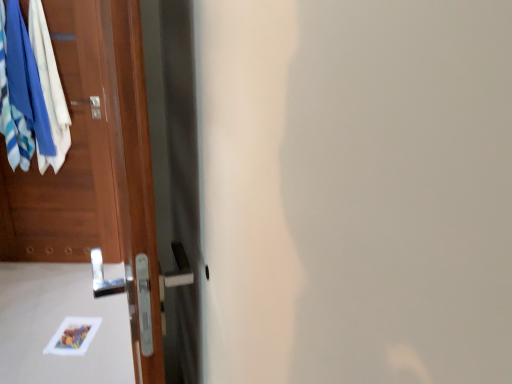
What is the approximate height of blue cotton socks at left?

blue cotton socks at left is 38.82 inches in height.

Image resolution: width=512 pixels, height=384 pixels. In order to click on blue cotton socks at left in this screenshot , I will do `click(31, 91)`.

Describe the element at coordinates (31, 91) in the screenshot. I see `blue cotton socks at left` at that location.

Describe the element at coordinates (94, 162) in the screenshot. I see `wooden door at left` at that location.

Image resolution: width=512 pixels, height=384 pixels. Identify the location of wooden door at left. [94, 162].

The image size is (512, 384). Identify the location of blue cotton socks at left. tap(31, 91).

Does blue cotton socks at left appear on the left side of wooden door at left?

Yes, blue cotton socks at left is to the left of wooden door at left.

Based on the photo, considering their positions, is blue cotton socks at left located in front of or behind wooden door at left?

blue cotton socks at left is positioned farther from the viewer than wooden door at left.

Is point (23, 133) closer to camera compared to point (49, 223)?

Yes, point (23, 133) is closer to viewer.

From the image's perspective, who appears lower, blue cotton socks at left or wooden door at left?

wooden door at left is shown below in the image.

From a real-world perspective, is blue cotton socks at left above or below wooden door at left?

blue cotton socks at left is situated higher than wooden door at left in the real world.

Does blue cotton socks at left have a greater width compared to wooden door at left?

Incorrect, the width of blue cotton socks at left does not surpass that of wooden door at left.

Based on the photo, does blue cotton socks at left have a lesser height compared to wooden door at left?

Yes, blue cotton socks at left is shorter than wooden door at left.

Who is smaller, blue cotton socks at left or wooden door at left?

blue cotton socks at left.

Would you say blue cotton socks at left contains wooden door at left?

No, wooden door at left is not surrounded by blue cotton socks at left.

Is blue cotton socks at left next to wooden door at left and touching it?

No, blue cotton socks at left is not next to wooden door at left.

Is blue cotton socks at left facing away from wooden door at left?

That's not correct — blue cotton socks at left is not looking away from wooden door at left.

This screenshot has width=512, height=384. What are the coordinates of `clothing lying above the wooden door at left (from the image's perspective)` in the screenshot? It's located at (31, 91).

Which object is positioned more to the left, wooden door at left or blue cotton socks at left?

Positioned to the left is blue cotton socks at left.

Who is more distant, wooden door at left or blue cotton socks at left?

blue cotton socks at left.

Between point (139, 378) and point (21, 62), which one is positioned in front?

The point (139, 378) is more forward.

From the image's perspective, would you say wooden door at left is positioned over blue cotton socks at left?

No, from the image's perspective, wooden door at left is not above blue cotton socks at left.

From a real-world perspective, is wooden door at left beneath blue cotton socks at left?

Correct, in the physical world, wooden door at left is lower than blue cotton socks at left.

Which object is wider, wooden door at left or blue cotton socks at left?

Wider between the two is wooden door at left.

In the scene shown: Which of these two, wooden door at left or blue cotton socks at left, stands shorter?

blue cotton socks at left.

Is wooden door at left smaller than blue cotton socks at left?

Incorrect, wooden door at left is not smaller in size than blue cotton socks at left.

Choose the correct answer: Is wooden door at left inside blue cotton socks at left or outside it?

wooden door at left exists outside the volume of blue cotton socks at left.

Is wooden door at left next to blue cotton socks at left and touching it?

No.

Is wooden door at left turned away from blue cotton socks at left?

Yes, blue cotton socks at left is at the back of wooden door at left.

How different are the orientations of wooden door at left and blue cotton socks at left in degrees?

They differ by 6.69 degrees in their facing directions.

Find the location of a particular element. The width and height of the screenshot is (512, 384). clothing lying behind the wooden door at left is located at coordinates (31, 91).

You are a GUI agent. You are given a task and a screenshot of the screen. Output one action in this format:
    pyautogui.click(x=<x>, y=<y>)
    Task: Click on the door lying below the blue cotton socks at left (from the image's perspective)
    
    Given the screenshot: What is the action you would take?
    pyautogui.click(x=94, y=162)

Find the location of a particular element. clothing above the wooden door at left (from a real-world perspective) is located at coordinates (31, 91).